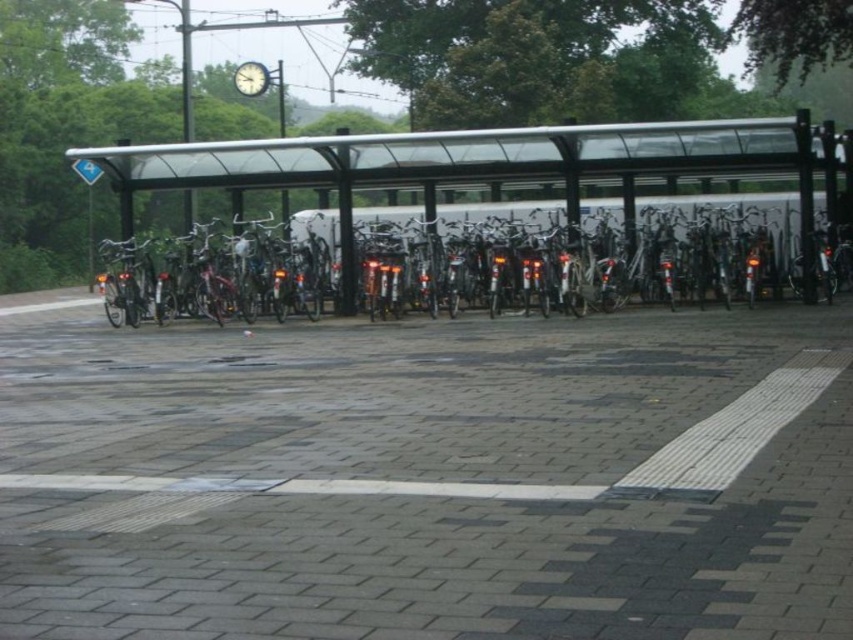
You are a delivery person needing to park your bike in the parking area. You see a metallic silver bicycle at center and a metallic clock at upper center. Which object is wider?

The metallic silver bicycle at center is wider than the metallic clock at upper center.

You are a delivery person who needs to load a metallic silver bicycle at center into a truck that has a height limit of 1.5 meters. Given that the metallic clock at upper center is known to be 2 meters tall, can the bicycle fit inside the truck?

The metallic silver bicycle at center is much taller than the metallic clock at upper center, which is 2 meters tall. Since the truck has a height limit of 1.5 meters, the bicycle cannot fit inside the truck.